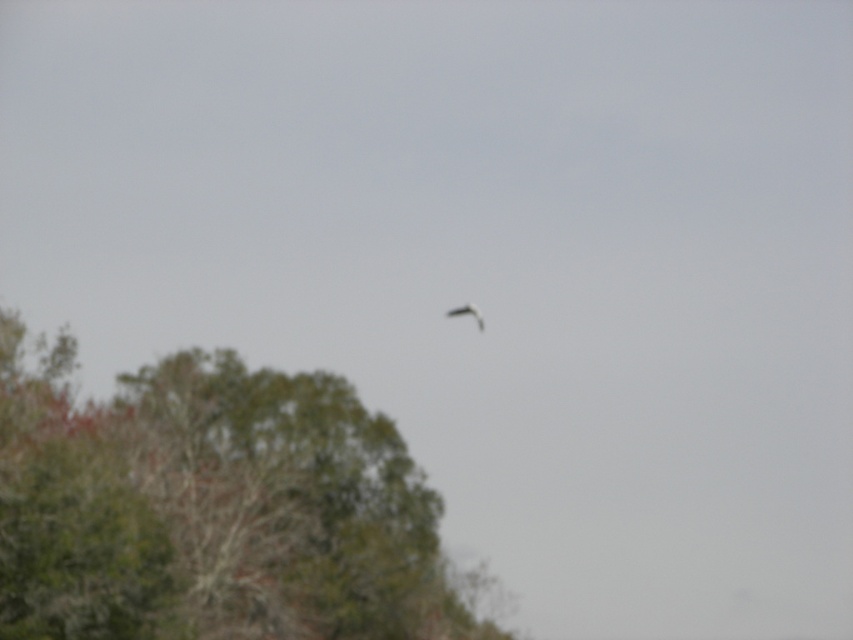
Is green leafy tree at lower left smaller than smooth gray bird at center?

No, green leafy tree at lower left is not smaller than smooth gray bird at center.

Between point (36, 340) and point (473, 316), which one is positioned behind?

Point (473, 316)

Between point (355, 448) and point (466, 310), which one is positioned behind?

Point (466, 310)

This screenshot has height=640, width=853. Find the location of `green leafy tree at lower left`. green leafy tree at lower left is located at coordinates (212, 508).